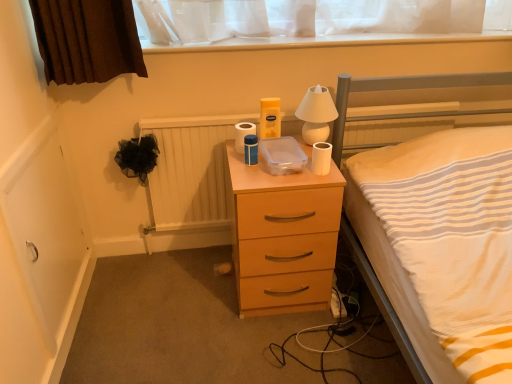
Question: Is point (166, 208) positioned closer to the camera than point (321, 142)?

Choices:
 (A) closer
 (B) farther

Answer: (B)

Question: In terms of width, does wooden radiator at center look wider or thinner when compared to white matte toilet paper at right, which ranks as the 1th toilet paper in front-to-back order?

Choices:
 (A) wide
 (B) thin

Answer: (A)

Question: Based on their relative distances, which object is farther from the white matte toilet paper at center, arranged as the second toilet paper when viewed from the right?

Choices:
 (A) white striped fabric at center
 (B) matte wood chest of drawers at center
 (C) wooden radiator at center
 (D) white matte toilet paper at right, which is the second toilet paper in back-to-front order
 (E) white glossy lamp at upper center

Answer: (A)

Question: Which object is positioned farthest from the wooden radiator at center?

Choices:
 (A) matte wood chest of drawers at center
 (B) white matte toilet paper at right, which ranks as the 1th toilet paper in front-to-back order
 (C) white matte toilet paper at center, which is the 2th toilet paper in front-to-back order
 (D) white striped fabric at center
 (E) white glossy lamp at upper center

Answer: (D)